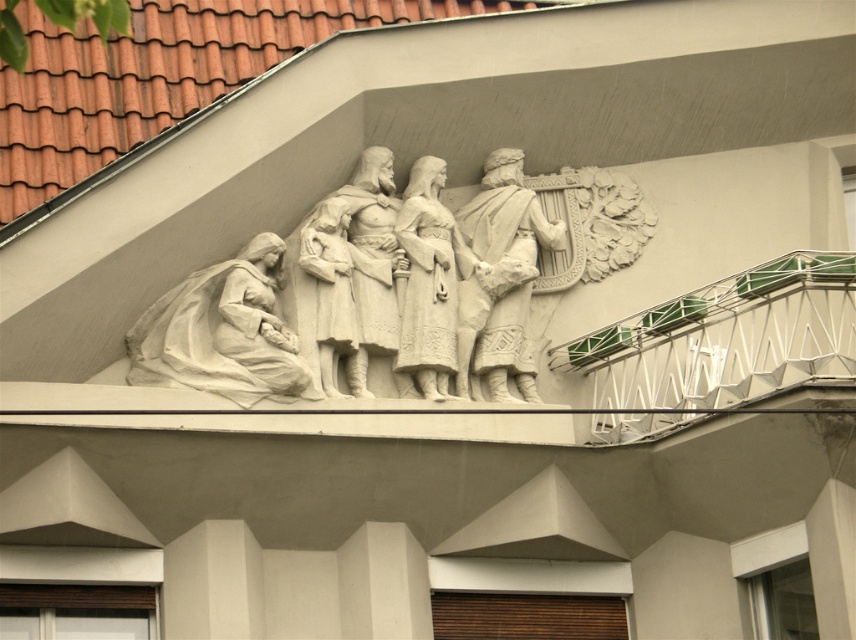
You are a photographer standing at the camera position. You want to take a closeup shot of the white stone figure at left. Considering the distance, is it feasible to capture a clear closeup without moving closer?

The white stone figure at left is 76.13 meters from the camera. At that distance, capturing a clear closeup without moving closer would be challenging due to the significant distance involved.